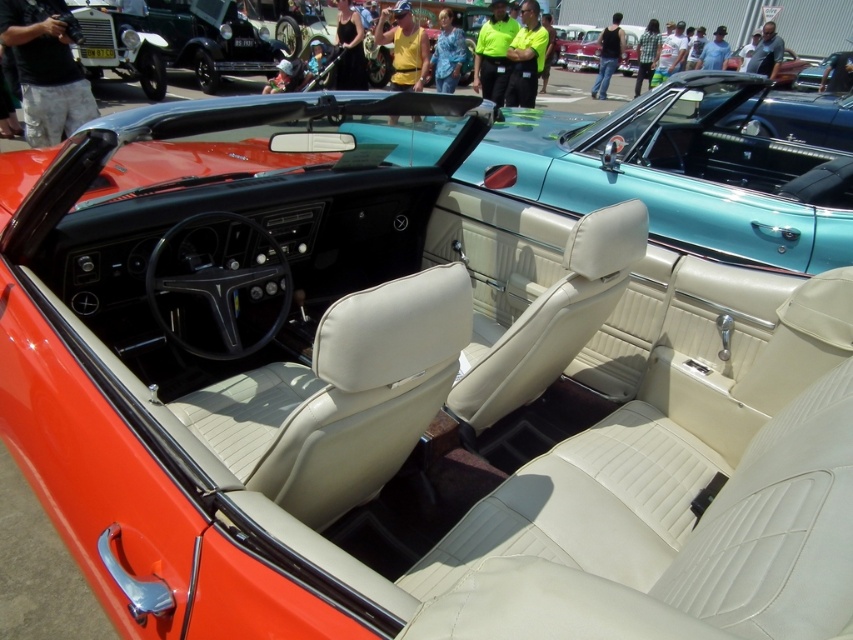
Question: Which point is closer to the camera?

Choices:
 (A) matte black convertible at upper center
 (B) matte black car at upper left

Answer: (B)

Question: Does matte black car at upper left appear over matte black convertible at upper center?

Choices:
 (A) yes
 (B) no

Answer: (B)

Question: Does matte black car at upper left have a larger size compared to matte black convertible at upper center?

Choices:
 (A) no
 (B) yes

Answer: (B)

Question: Is matte black car at upper left wider than matte black convertible at upper center?

Choices:
 (A) no
 (B) yes

Answer: (B)

Question: Which object appears farthest from the camera in this image?

Choices:
 (A) matte black convertible at upper center
 (B) matte black car at upper left

Answer: (A)

Question: Which point is closer to the camera taking this photo?

Choices:
 (A) (634, 52)
 (B) (227, 26)

Answer: (B)